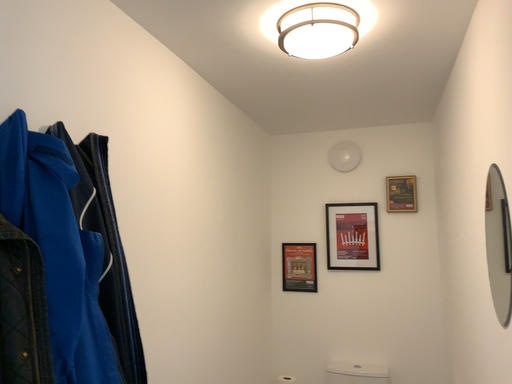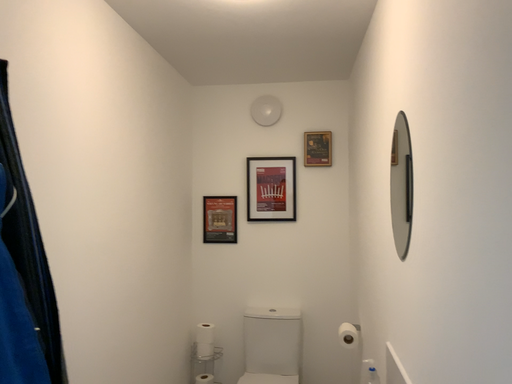
Question: How did the camera likely rotate when shooting the video?

Choices:
 (A) rotated left
 (B) rotated right

Answer: (B)